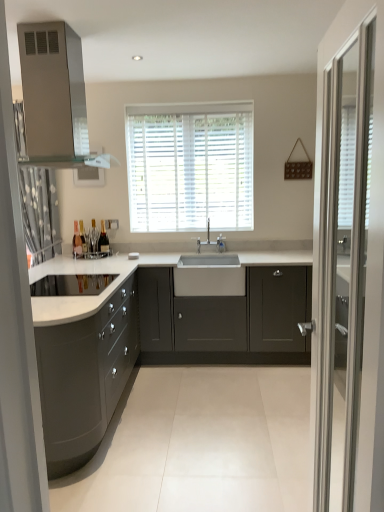
Find the location of a particular element. The height and width of the screenshot is (512, 384). vacant space situated on the left part of satin nickel faucet at center is located at coordinates (213, 251).